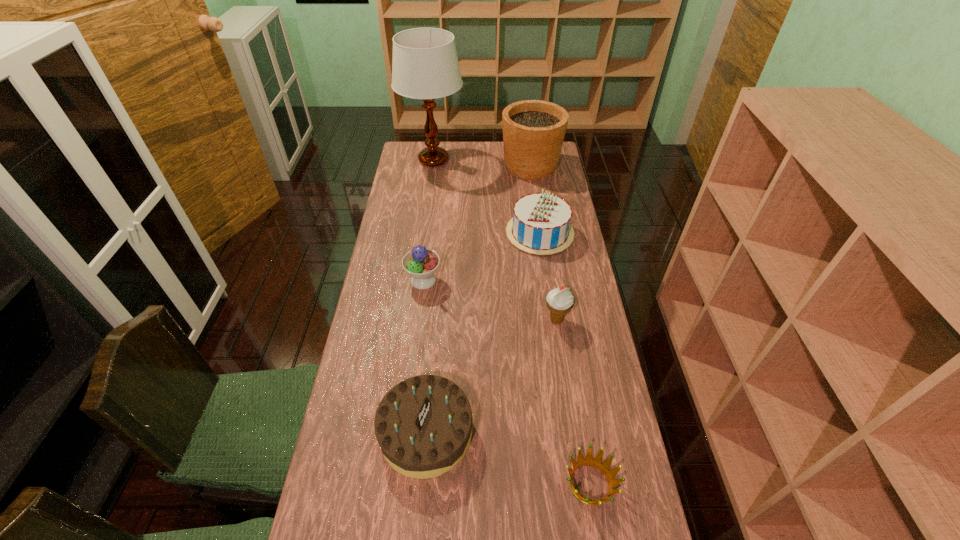
Find the location of a particular element. the tallest object is located at coordinates (425, 65).

Locate an element on the screen. The width and height of the screenshot is (960, 540). the sixth shortest object is located at coordinates (533, 130).

In order to click on the nearer icecream in this screenshot , I will do `click(560, 301)`.

I want to click on the fifth farthest object, so click(x=560, y=301).

You are a GUI agent. You are given a task and a screenshot of the screen. Output one action in this format:
    pyautogui.click(x=<x>, y=<y>)
    Task: Click on the left icecream
    This screenshot has width=960, height=540.
    Given the screenshot: What is the action you would take?
    pyautogui.click(x=421, y=263)

At what (x,y) coordinates should I click in order to perform the action: click on the farther icecream. Please return your answer as a coordinate pair (x, y). Looking at the image, I should click on (421, 263).

Identify the location of the fifth nearest object. This screenshot has height=540, width=960. (540, 225).

The width and height of the screenshot is (960, 540). I want to click on the taller birthday cake, so click(x=540, y=225).

You are a GUI agent. You are given a task and a screenshot of the screen. Output one action in this format:
    pyautogui.click(x=<x>, y=<y>)
    Task: Click on the nearer birthday cake
    The image size is (960, 540).
    Given the screenshot: What is the action you would take?
    pyautogui.click(x=423, y=425)

I want to click on the shorter birthday cake, so click(423, 425).